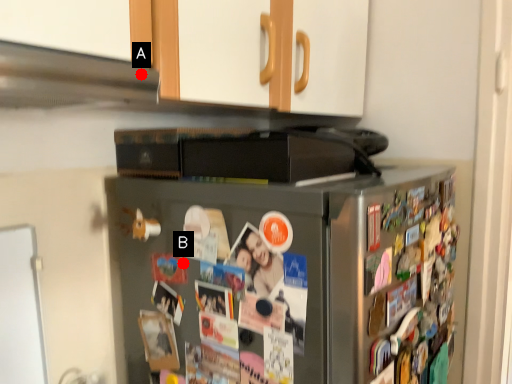
Question: Two points are circled on the image, labeled by A and B beside each circle. Which point is farther from the camera taking this photo?

Choices:
 (A) A is further
 (B) B is further

Answer: (B)